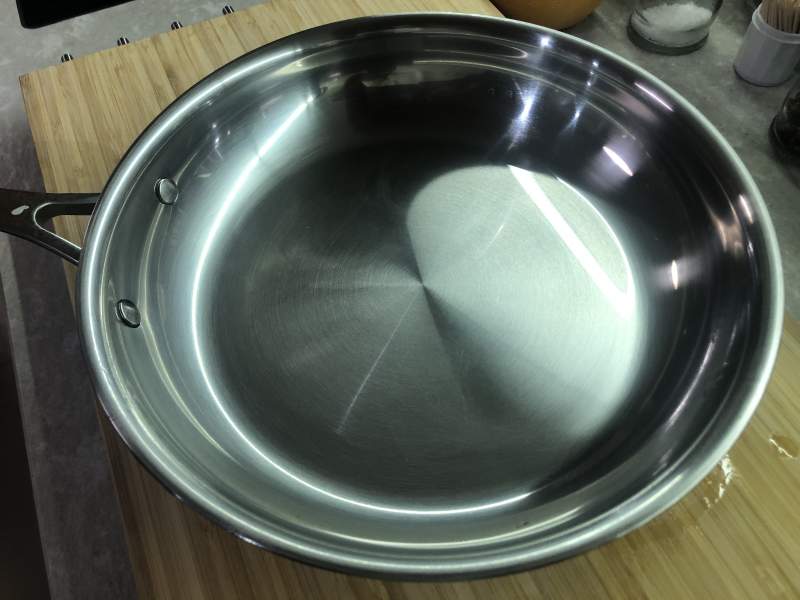
Locate an element on the screen. handle is located at coordinates (34, 216).